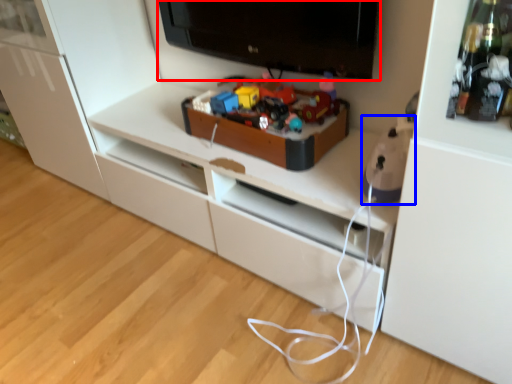
Question: Which point is further to the camera, television (highlighted by a red box) or toy (highlighted by a blue box)?

Choices:
 (A) television
 (B) toy

Answer: (A)